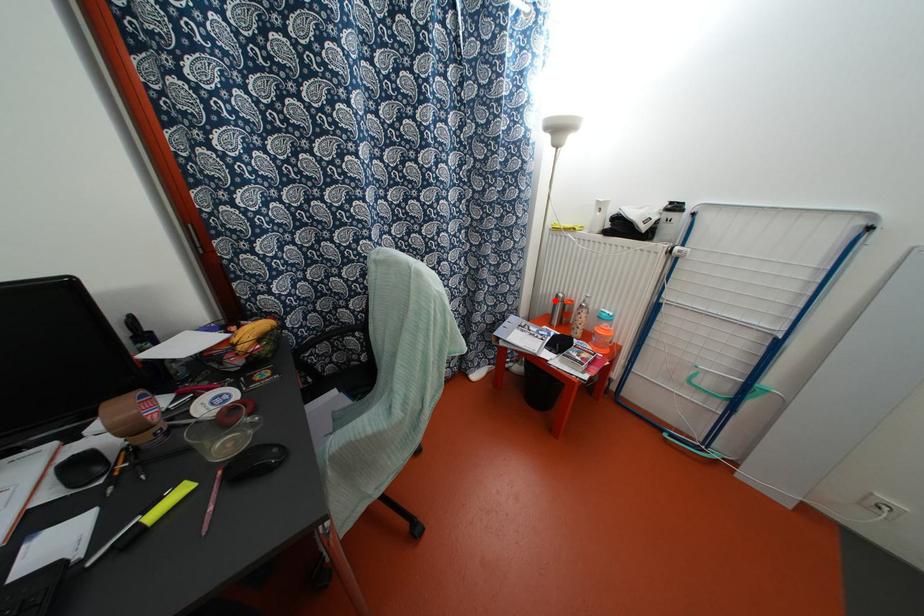
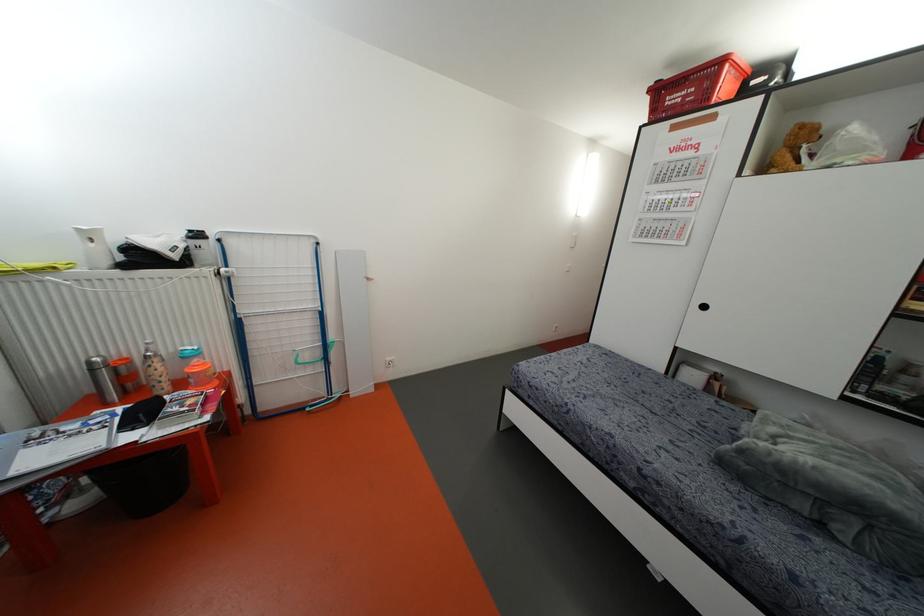
Where in the second image is the point corresponding to the highlighted location from the first image?

(91, 370)